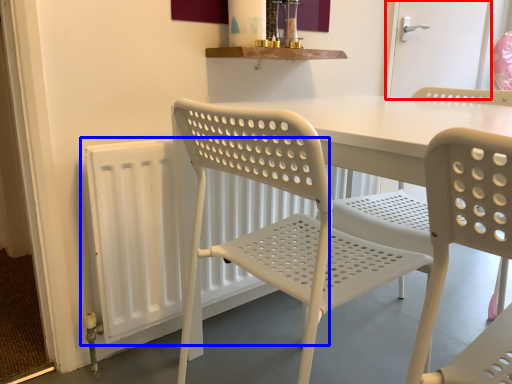
Question: Which object is further to the camera taking this photo, screen door (highlighted by a red box) or radiator (highlighted by a blue box)?

Choices:
 (A) screen door
 (B) radiator

Answer: (A)